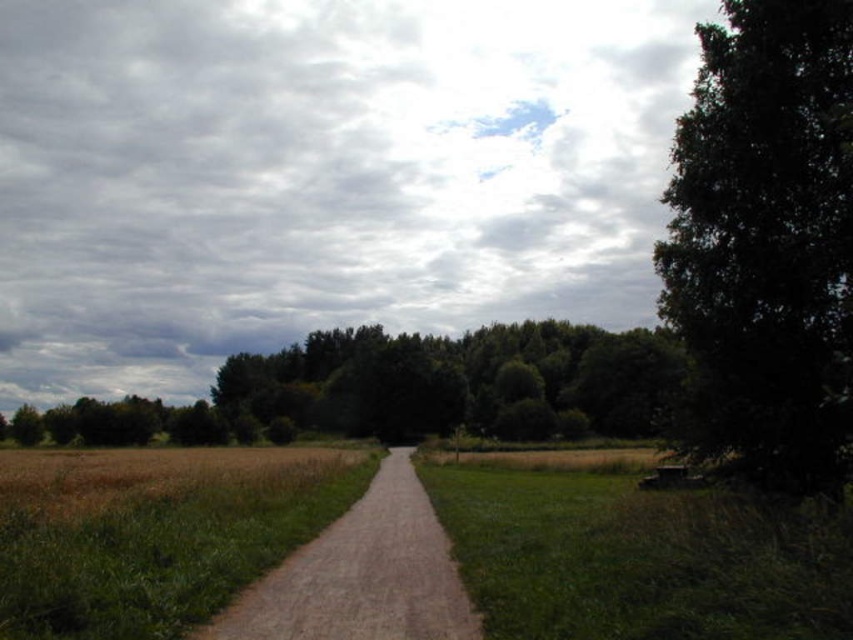
Measure the distance between dark green leafy tree at right and camera.

They are 46.66 feet apart.

Between dark green leafy tree at right and green leafy trees at center, which one is positioned lower?

green leafy trees at center is lower down.

Does point (851, 288) lie behind point (248, 362)?

No, it is not.

The width and height of the screenshot is (853, 640). What are the coordinates of `dark green leafy tree at right` in the screenshot? It's located at (767, 241).

Can you confirm if green leafy trees at center is bigger than dirt/gravel path at center?

Correct, green leafy trees at center is larger in size than dirt/gravel path at center.

Is green leafy trees at center thinner than dirt/gravel path at center?

Incorrect, green leafy trees at center's width is not less than dirt/gravel path at center's.

Does point (653, 435) lie behind point (306, 547)?

Yes, point (653, 435) is farther from viewer.

Where is `green leafy trees at center`? The image size is (853, 640). green leafy trees at center is located at coordinates (405, 388).

Which of these two, dark green leafy tree at right or dirt/gravel path at center, stands taller?

dark green leafy tree at right

Which is in front, point (837, 129) or point (369, 490)?

Point (837, 129) is in front.

Where is `dark green leafy tree at right`? The height and width of the screenshot is (640, 853). dark green leafy tree at right is located at coordinates click(767, 241).